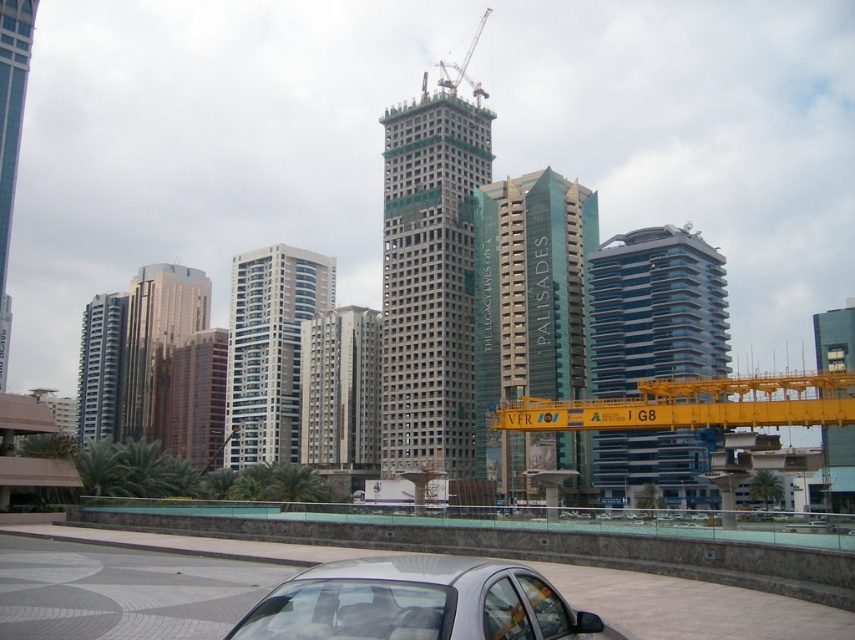
You are a delivery driver who needs to park your truck, which is 2.5 meters wide, in the parking area. You see a sleek metallic car at lower center and a satin silver car at lower center. Can you determine if there is enough space between them to park your truck?

The sleek metallic car at lower center might be wider than the satin silver car at lower center, so there is insufficient information to determine if the space between them is wide enough for your 2.5 meter wide truck. You should check the actual width of both cars before deciding.